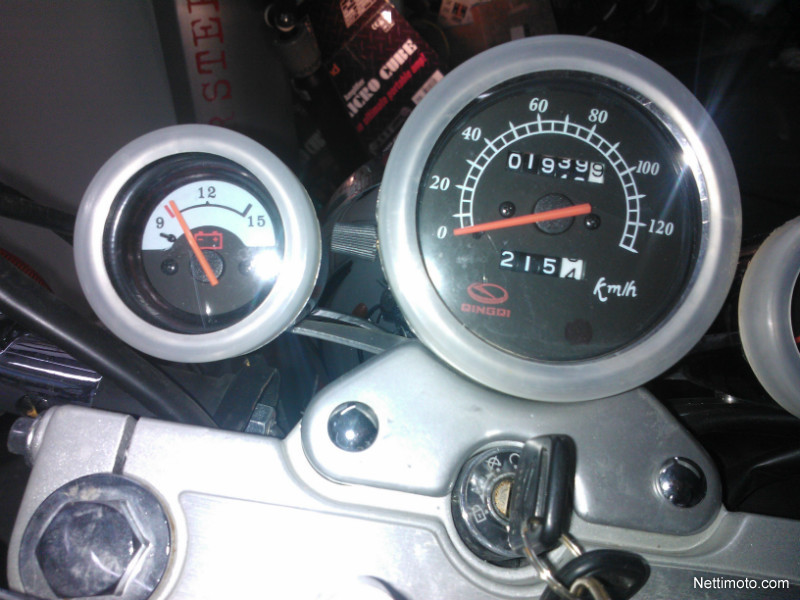
The height and width of the screenshot is (600, 800). I want to click on keys, so click(540, 479), click(618, 568).